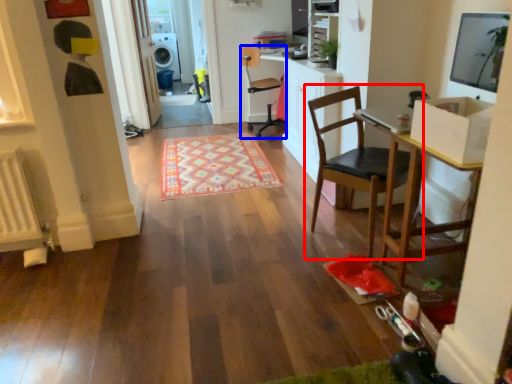
Question: Which point is closer to the camera, chair (highlighted by a red box) or chair (highlighted by a blue box)?

Choices:
 (A) chair
 (B) chair

Answer: (A)